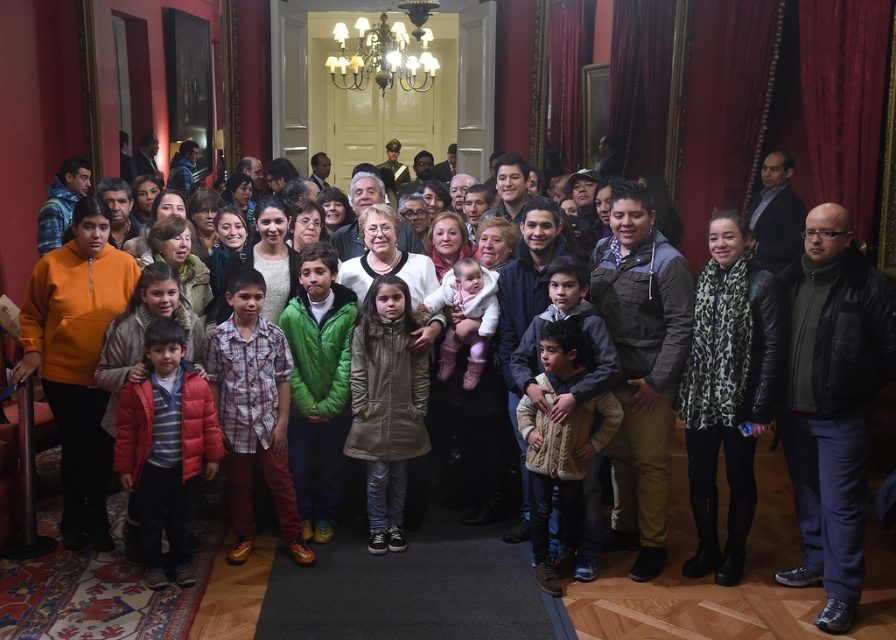
You are a photographer standing in the hallway and want to take a photo of the knitted beige sweater at center and the white fluffy coat at center. If your camera can capture objects within a 1 meter range, will both items be in the frame?

The knitted beige sweater at center is 73.19 centimeters away from the white fluffy coat at center. Since 73.19 centimeters is less than 1 meter, both items will be within the camera range and appear in the frame.